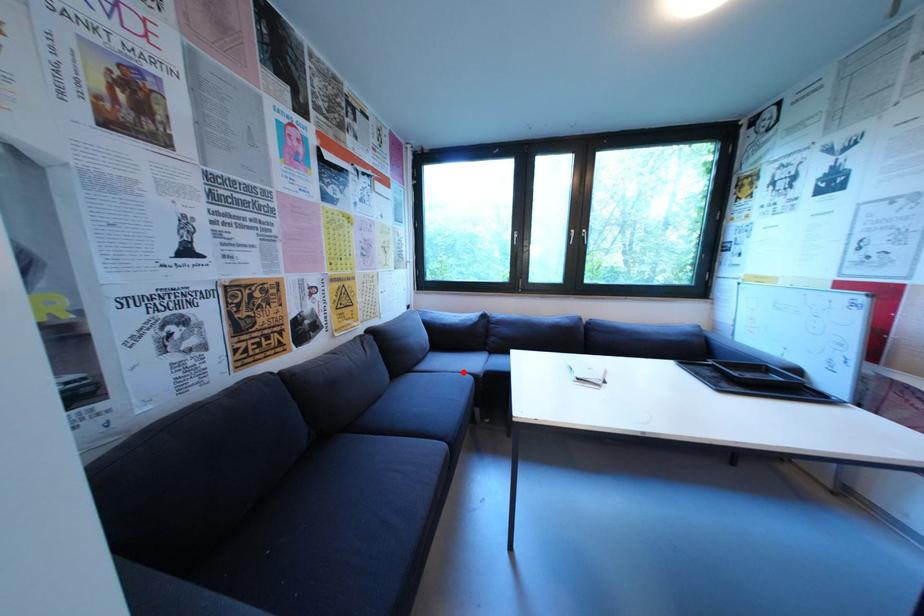
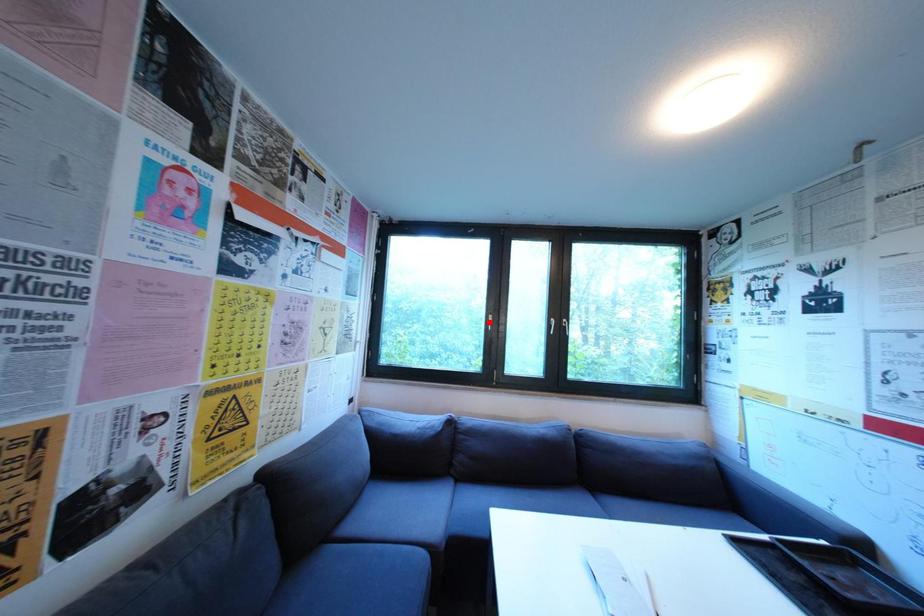
I am providing you with two images of the same scene from different viewpoints. A red point is marked on the first image and another point is marked on the second image. Do the highlighted points in image1 and image2 indicate the same real-world spot?

No